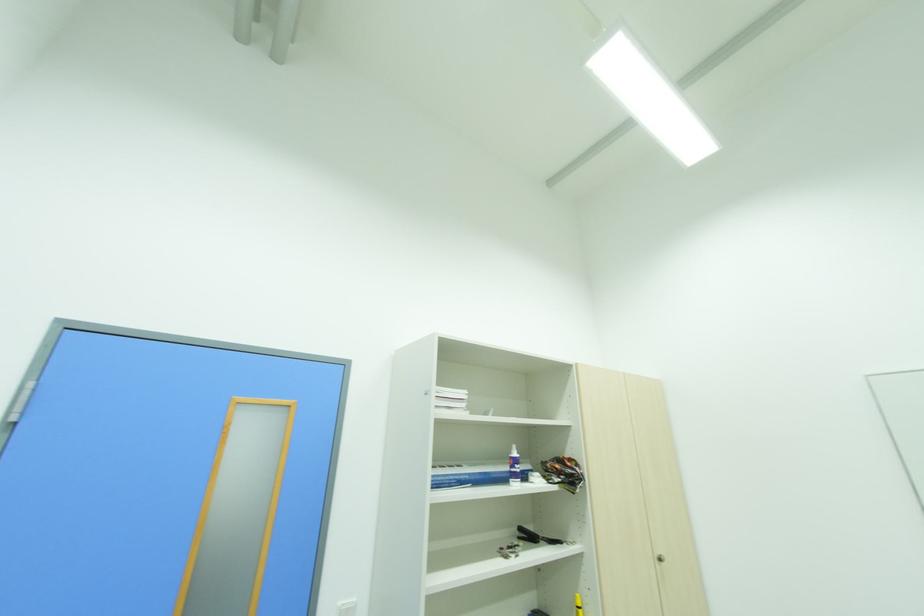
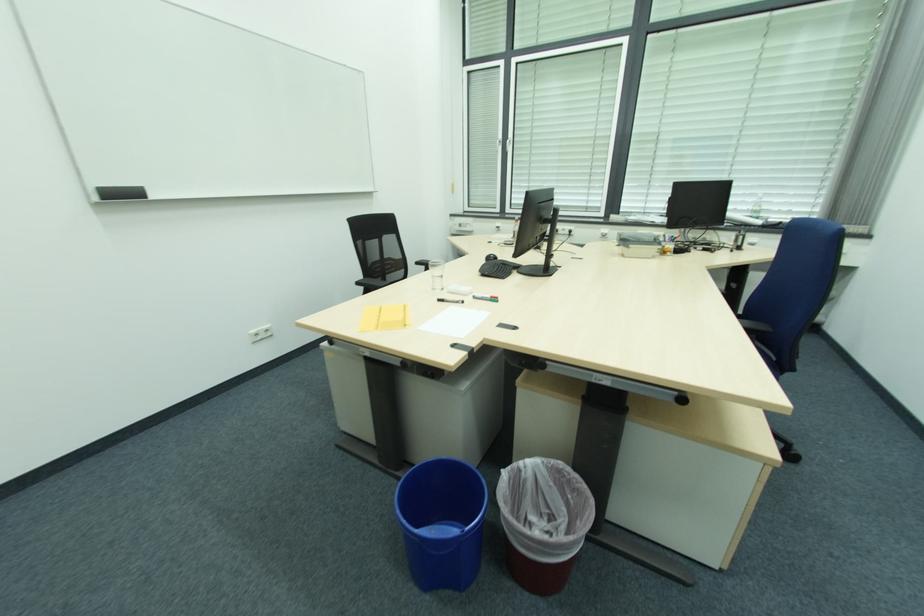
Question: How did the camera likely rotate?

Choices:
 (A) Left
 (B) Right
 (C) Up
 (D) Down

Answer: (B)